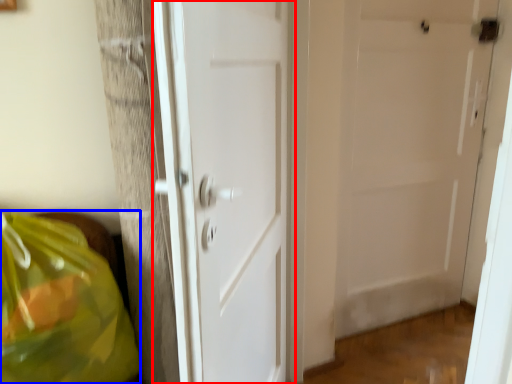
Question: Which point is further to the camera, door (highlighted by a red box) or grocery bag (highlighted by a blue box)?

Choices:
 (A) door
 (B) grocery bag

Answer: (B)